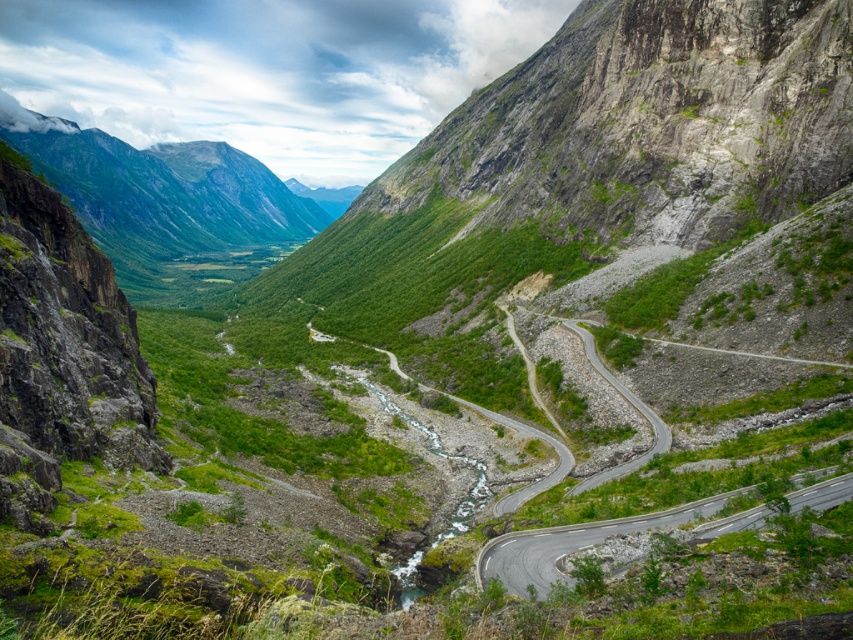
Question: Which object appears farthest from the camera in this image?

Choices:
 (A) gray asphalt road at lower right
 (B) green grassy mountain at upper left

Answer: (B)

Question: Which object appears farthest from the camera in this image?

Choices:
 (A) green grassy mountain at upper left
 (B) gray asphalt road at lower right

Answer: (A)

Question: Which object appears closest to the camera in this image?

Choices:
 (A) gray asphalt road at lower right
 (B) green grassy mountain at upper left

Answer: (A)

Question: Considering the relative positions of green grassy mountain at upper left and gray asphalt road at lower right in the image provided, where is green grassy mountain at upper left located with respect to gray asphalt road at lower right?

Choices:
 (A) above
 (B) below

Answer: (A)

Question: Can you confirm if green grassy mountain at upper left is positioned below gray asphalt road at lower right?

Choices:
 (A) yes
 (B) no

Answer: (B)

Question: Does green grassy mountain at upper left have a greater width compared to gray asphalt road at lower right?

Choices:
 (A) yes
 (B) no

Answer: (A)